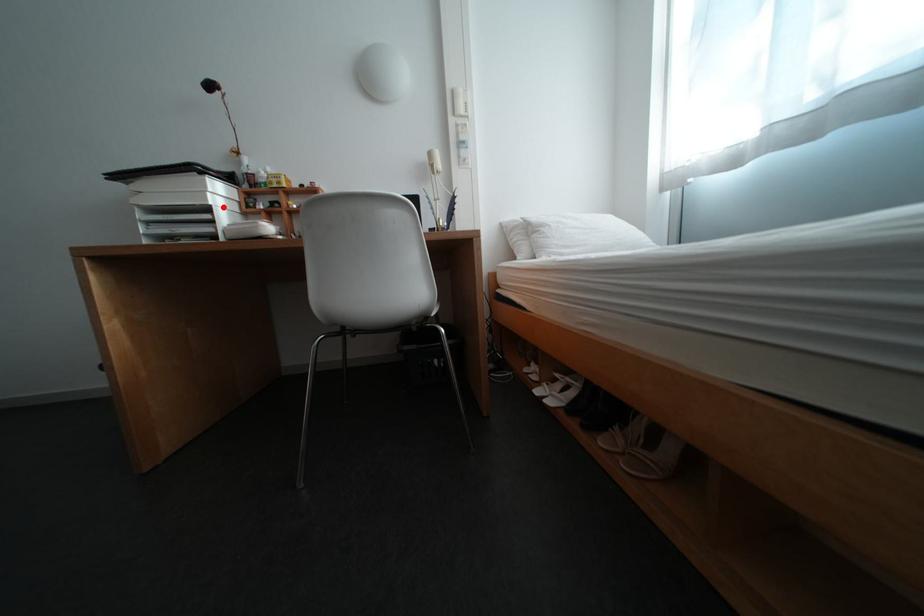
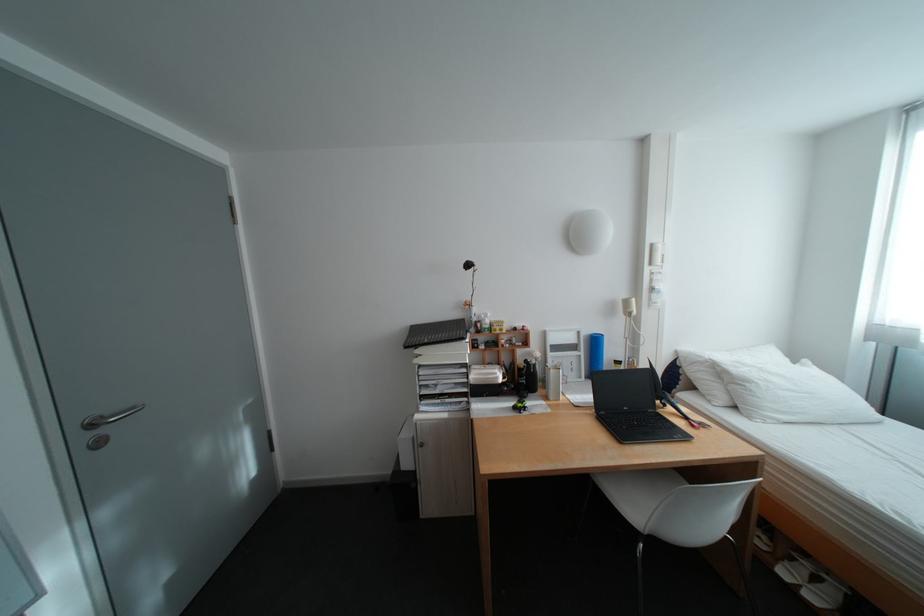
In the second image, find the point that corresponds to the highlighted location in the first image.

(480, 363)